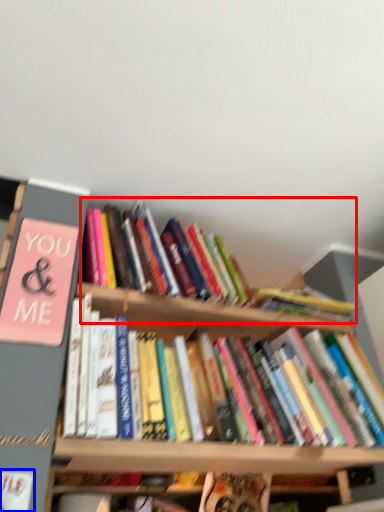
Question: Which object appears closest to the camera in this image, book (highlighted by a red box) or book (highlighted by a blue box)?

Choices:
 (A) book
 (B) book

Answer: (B)